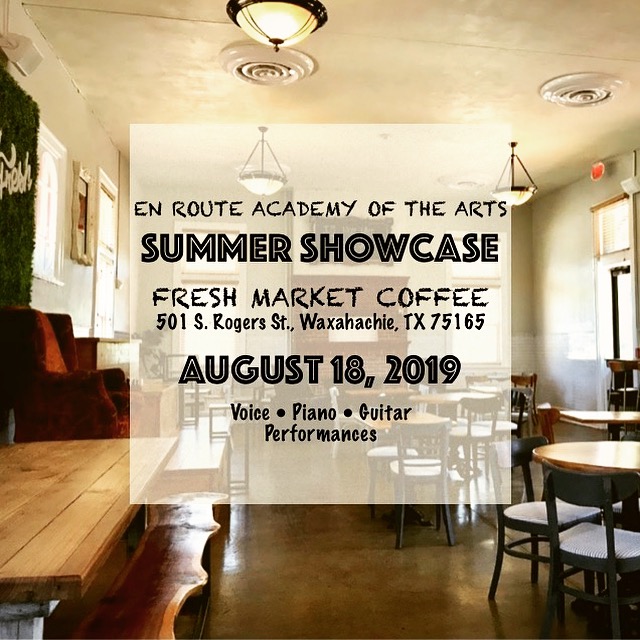
The height and width of the screenshot is (640, 640). I want to click on transparent box, so click(385, 159).